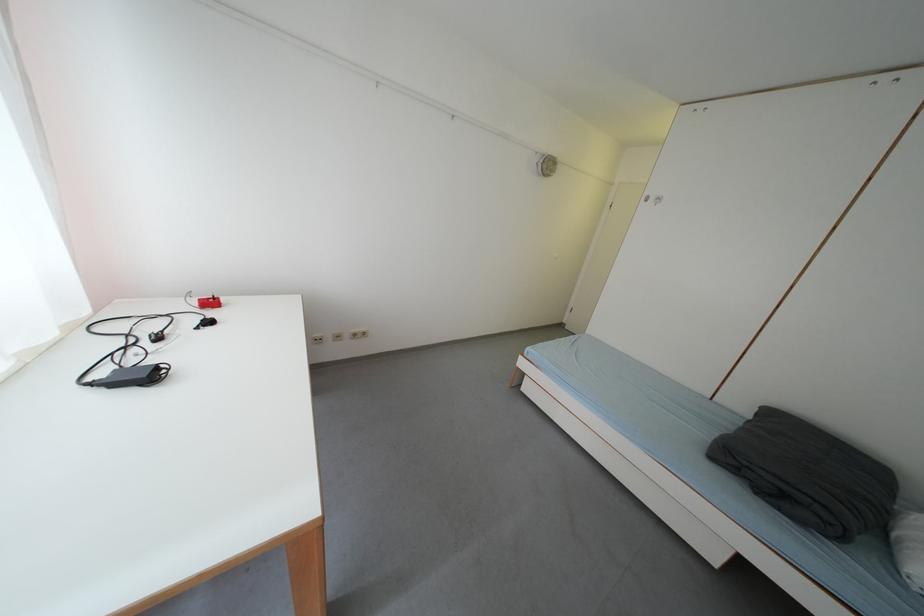
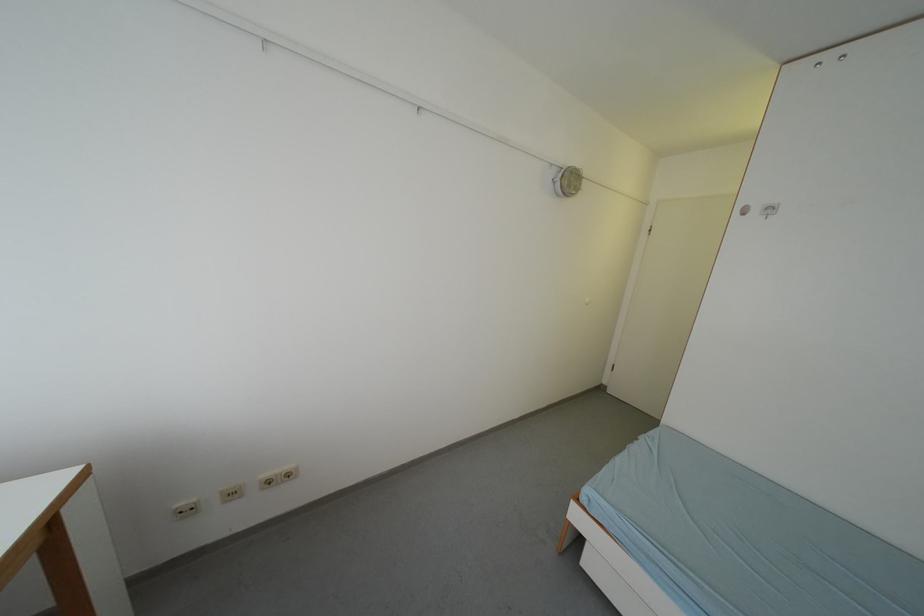
Question: Which direction would the cameraman need to move to produce the second image? Reply with the corresponding letter.

Choices:
 (A) Left
 (B) Right
 (C) Forward
 (D) Backward

Answer: (C)